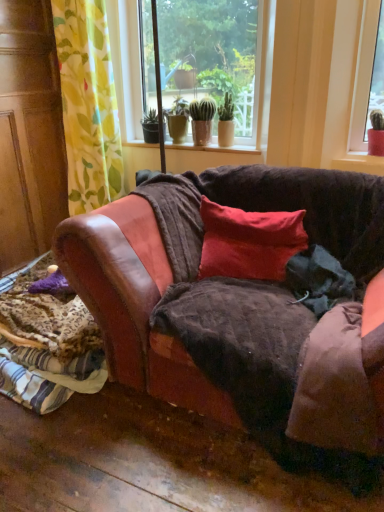
Question: Visually, is matte ceramic pots at center positioned to the left or to the right of red velvet pillow at center?

Choices:
 (A) right
 (B) left

Answer: (B)

Question: Is point (152, 44) positioned closer to the camera than point (261, 263)?

Choices:
 (A) farther
 (B) closer

Answer: (A)

Question: Based on their relative distances, which object is farther from the brown leather couch at center?

Choices:
 (A) red velvet pillow at center
 (B) smooth concrete window sill at center
 (C) leather couch at lower left
 (D) yellow-green floral fabric at left
 (E) matte ceramic pots at center

Answer: (E)

Question: Estimate the real-world distances between objects in this image. Which object is farther from the matte ceramic pots at center?

Choices:
 (A) brown leather couch at center
 (B) yellow-green floral fabric at left
 (C) red velvet pillow at center
 (D) smooth concrete window sill at center
 (E) leather couch at lower left

Answer: (E)